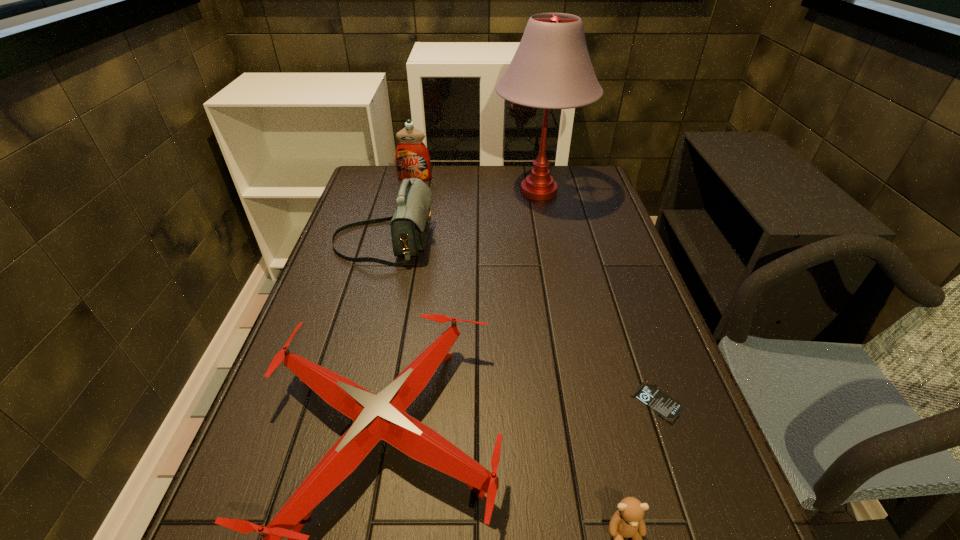
This screenshot has width=960, height=540. I want to click on free region at the left edge of the desktop, so click(323, 330).

In the image, there is a desktop. Identify the location of vacant space at the right edge. This screenshot has height=540, width=960. (592, 226).

You are a GUI agent. You are given a task and a screenshot of the screen. Output one action in this format:
    pyautogui.click(x=<x>, y=<y>)
    Task: Click on the free location at the far left corner
    The height and width of the screenshot is (540, 960).
    Given the screenshot: What is the action you would take?
    pyautogui.click(x=364, y=187)

Where is `free space that is in between the shoulder bag and the table lamp`? This screenshot has width=960, height=540. free space that is in between the shoulder bag and the table lamp is located at coordinates (461, 217).

Where is `vacant area that lies between the identity card and the table lamp`? vacant area that lies between the identity card and the table lamp is located at coordinates (x=597, y=296).

Image resolution: width=960 pixels, height=540 pixels. In order to click on vacant space that is in between the shoulder bag and the identity card in this screenshot , I will do `click(519, 321)`.

In order to click on unoccupied area between the identity card and the shoulder bag in this screenshot , I will do `click(519, 321)`.

Find the location of `free spot between the second tallest object and the table lamp`. free spot between the second tallest object and the table lamp is located at coordinates click(x=477, y=185).

Where is `the third closest object to the drone`? Image resolution: width=960 pixels, height=540 pixels. the third closest object to the drone is located at coordinates (667, 408).

Point out which object is positioned as the fourth nearest to the fifth shortest object. Please provide its 2D coordinates. Your answer should be formatted as a tuple, i.e. [(x, y)], where the tuple contains the x and y coordinates of a point satisfying the conditions above.

[(667, 408)]